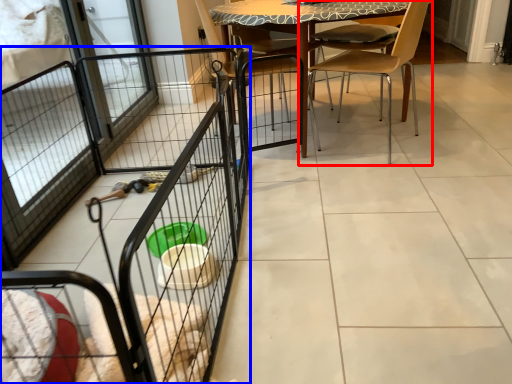
Question: Which point is further to the camera, chair (highlighted by a red box) or cage (highlighted by a blue box)?

Choices:
 (A) chair
 (B) cage

Answer: (A)